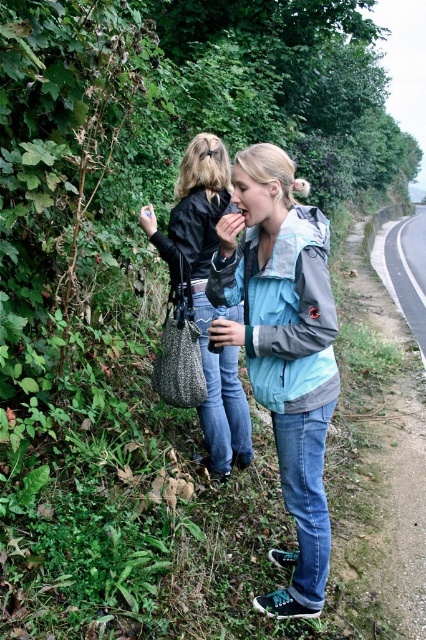
You are a photographer trying to capture both the light blue fabric jacket at center and the leather jacket at center in a single frame. Given that your camera has a minimum focus distance of 20 inches, will you be able to focus on both jackets simultaneously?

The light blue fabric jacket at center and the leather jacket at center are 23.08 inches apart, which is greater than the camera minimum focus distance of 20 inches. Therefore, the camera can focus on both jackets simultaneously.

You are standing 10 feet away from the camera. You want to hand a document to the person wearing the light blue fabric jacket at center. Can you reach them without moving closer?

The light blue fabric jacket at center is 6.94 feet away from the camera. Since you are 10 feet away from the camera, you are 3.06 feet behind the person. You cannot reach them without moving closer.

You are a photographer trying to capture both the light blue fabric jacket at center and the leather jacket at center in a single frame. Which jacket should you focus on first to ensure both are in the shot?

The light blue fabric jacket at center is positioned on the right side of the leather jacket at center, so you should focus on the leather jacket at center first to ensure both are in the shot.